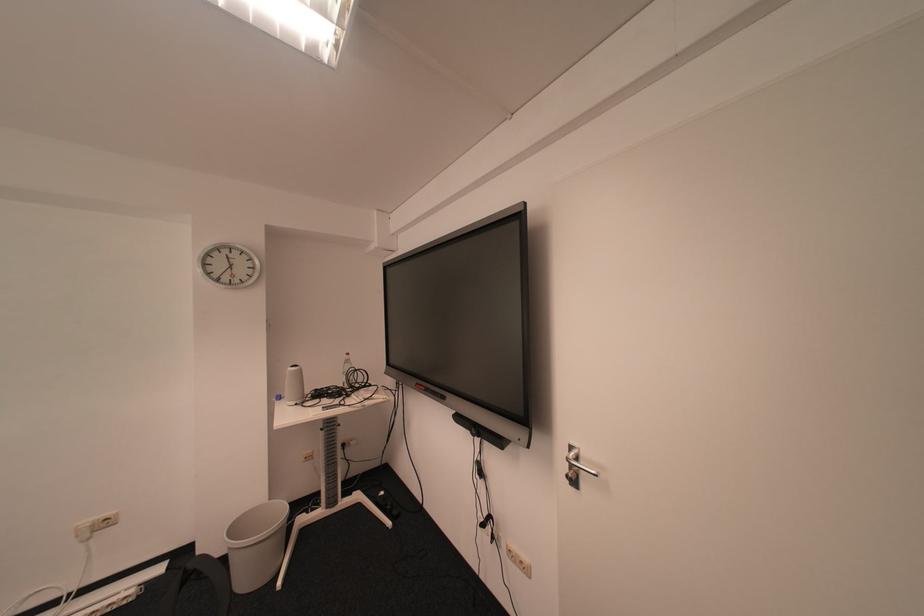
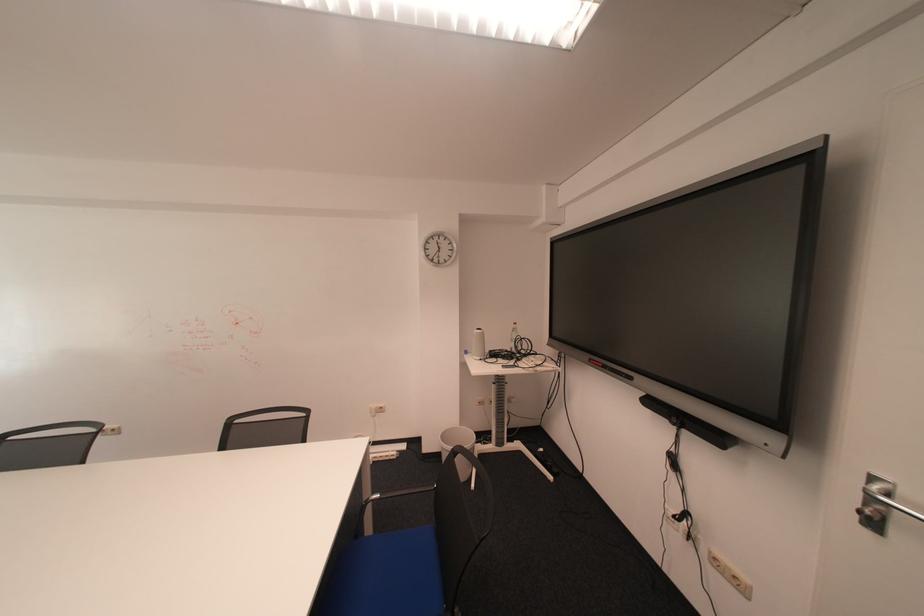
The point at (287, 402) is marked in the first image. Where is the corresponding point in the second image?

(477, 355)